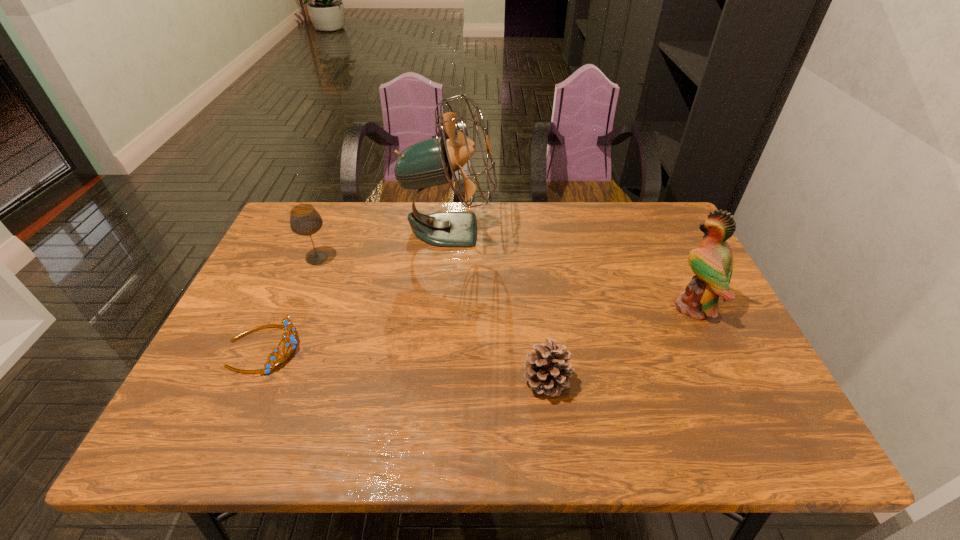
Find the location of a particular element. The width and height of the screenshot is (960, 540). object at the far left corner is located at coordinates (304, 219).

The width and height of the screenshot is (960, 540). What are the coordinates of `vacant position at the far edge of the desktop` in the screenshot? It's located at [403, 218].

Locate an element on the screen. This screenshot has width=960, height=540. vacant space at the near edge of the desktop is located at coordinates (550, 421).

You are a GUI agent. You are given a task and a screenshot of the screen. Output one action in this format:
    pyautogui.click(x=<x>, y=<y>)
    Task: Click on the free space at the left edge of the desktop
    The image size is (960, 540).
    Given the screenshot: What is the action you would take?
    pyautogui.click(x=304, y=251)

You are a GUI agent. You are given a task and a screenshot of the screen. Output one action in this format:
    pyautogui.click(x=<x>, y=<y>)
    Task: Click on the vacant space at the right edge of the desktop
    The width and height of the screenshot is (960, 540).
    Given the screenshot: What is the action you would take?
    pyautogui.click(x=763, y=408)

Locate an element on the screen. The width and height of the screenshot is (960, 540). vacant space that's between the shortest object and the wineglass is located at coordinates (291, 303).

You are a GUI agent. You are given a task and a screenshot of the screen. Output one action in this format:
    pyautogui.click(x=<x>, y=<y>)
    Task: Click on the free space between the shortest object and the third tallest object
    
    Given the screenshot: What is the action you would take?
    point(291,303)

Locate an element on the screen. The height and width of the screenshot is (540, 960). free spot between the second tallest object and the fan is located at coordinates (571, 268).

At what (x,y) coordinates should I click in order to perform the action: click on free point between the third shortest object and the second tallest object. Please return your answer as a coordinate pair (x, y). Looking at the image, I should click on (506, 282).

The width and height of the screenshot is (960, 540). In order to click on free space between the wineglass and the tallest object in this screenshot , I will do `click(383, 244)`.